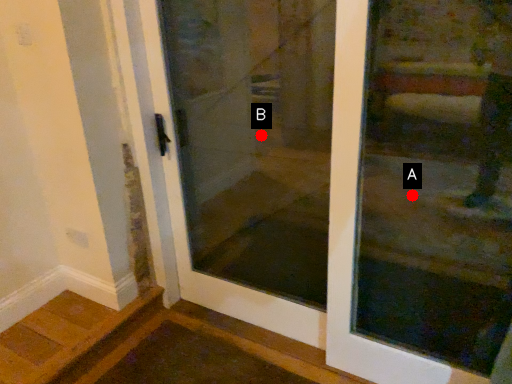
Question: Two points are circled on the image, labeled by A and B beside each circle. Which of the following is the farthest from the observer?

Choices:
 (A) A is further
 (B) B is further

Answer: (B)